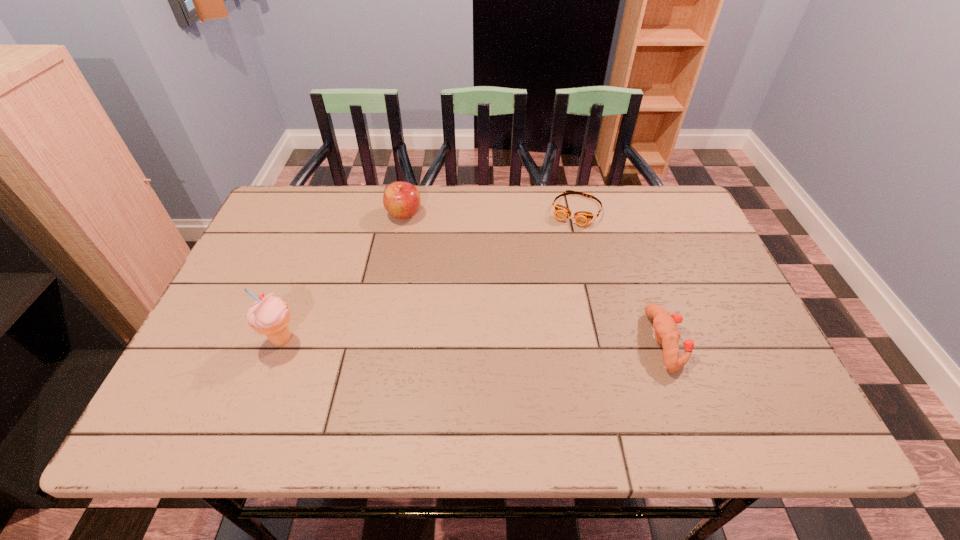
Find the location of a particular element. the tallest object is located at coordinates (269, 315).

Where is `icecream`? This screenshot has width=960, height=540. icecream is located at coordinates (269, 315).

You are a GUI agent. You are given a task and a screenshot of the screen. Output one action in this format:
    pyautogui.click(x=<x>, y=<y>)
    Task: Click on the rightmost object
    This screenshot has height=540, width=960.
    Given the screenshot: What is the action you would take?
    pyautogui.click(x=664, y=323)

You are a GUI agent. You are given a task and a screenshot of the screen. Output one action in this format:
    pyautogui.click(x=<x>, y=<y>)
    Task: Click on the puncher
    The image size is (960, 540).
    Given the screenshot: What is the action you would take?
    [664, 323]

Find the location of a particular element. Image resolution: width=960 pixels, height=540 pixels. the third object from left to right is located at coordinates (582, 218).

Locate an element on the screen. The image size is (960, 540). goggles is located at coordinates (582, 218).

Where is `the third object from right to left`? Image resolution: width=960 pixels, height=540 pixels. the third object from right to left is located at coordinates (402, 200).

I want to click on apple, so click(x=402, y=200).

Identify the location of vacant space located on the right of the tallest object. (x=345, y=340).

In order to click on vacant space located 0.070m with the gloves of the rightmost object facing forward in this screenshot , I will do `click(713, 342)`.